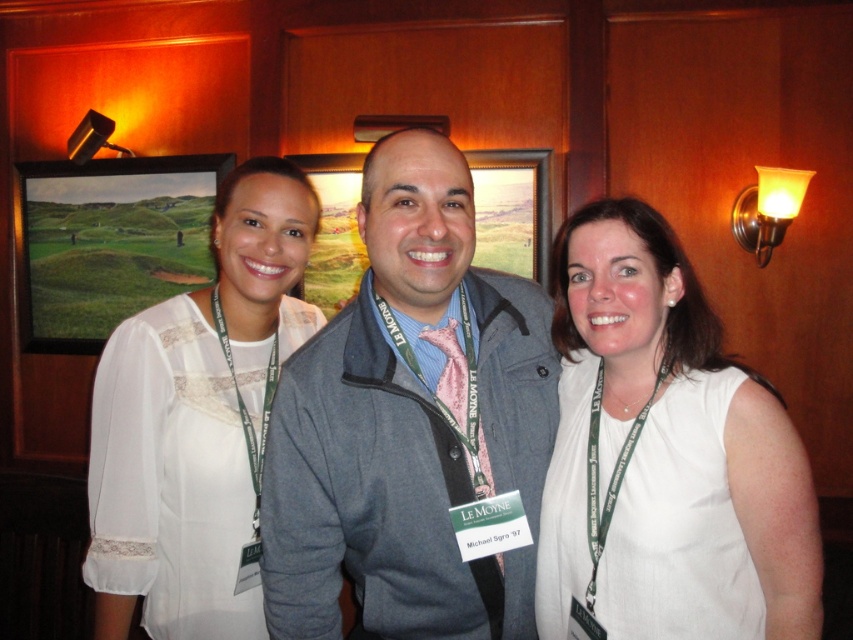
Can you confirm if white lace blouse at left is positioned to the right of green matte picture frame at upper left?

Correct, you'll find white lace blouse at left to the right of green matte picture frame at upper left.

Is point (282, 216) more distant than point (22, 272)?

No, (282, 216) is closer to viewer.

Does point (187, 596) come in front of point (61, 340)?

Yes, point (187, 596) is in front of point (61, 340).

This screenshot has height=640, width=853. I want to click on white lace blouse at left, so 198,420.

Between point (459, 586) and point (86, 310), which one is positioned behind?

The point (86, 310) is behind.

Is gray fabric jacket at center taller than green matte picture frame at upper left?

Correct, gray fabric jacket at center is much taller as green matte picture frame at upper left.

Which is behind, point (341, 321) or point (35, 188)?

The point (35, 188) is more distant.

I want to click on gray fabric jacket at center, so click(x=409, y=422).

Between point (418, 570) and point (354, 204), which one is positioned behind?

Point (354, 204)

This screenshot has height=640, width=853. What do you see at coordinates (409, 422) in the screenshot? I see `gray fabric jacket at center` at bounding box center [409, 422].

What are the coordinates of `gray fabric jacket at center` in the screenshot? It's located at (409, 422).